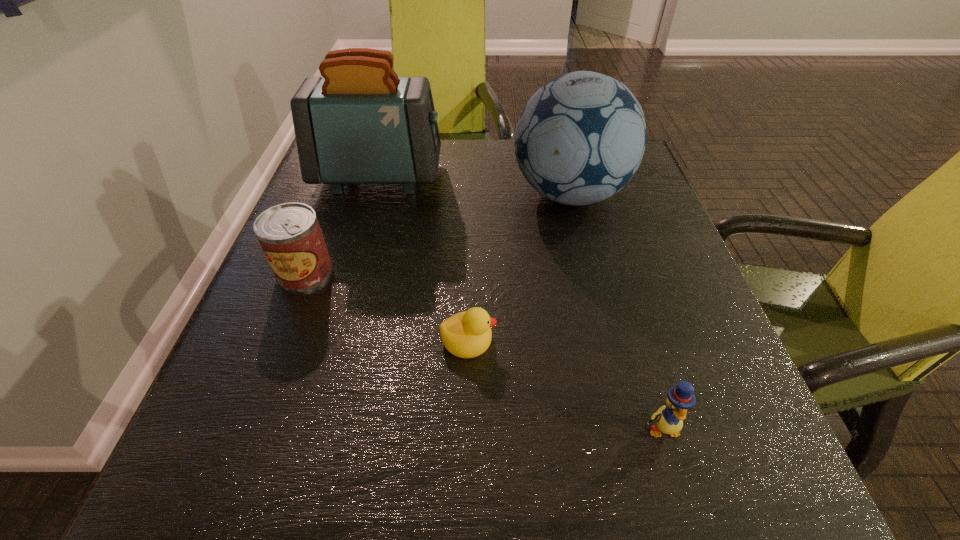
This screenshot has height=540, width=960. Identify the location of vacant space in between the shortest object and the third farthest object. (387, 306).

You are a GUI agent. You are given a task and a screenshot of the screen. Output one action in this format:
    pyautogui.click(x=<x>, y=<y>)
    Task: Click on the unoccupied area between the taller duckling and the farther duckling
    Image resolution: width=960 pixels, height=540 pixels.
    Given the screenshot: What is the action you would take?
    pyautogui.click(x=564, y=383)

Where is `blank region between the soccer ball and the third object from left to right`? The width and height of the screenshot is (960, 540). blank region between the soccer ball and the third object from left to right is located at coordinates (518, 267).

You are a GUI agent. You are given a task and a screenshot of the screen. Output one action in this format:
    pyautogui.click(x=<x>, y=<y>)
    Task: Click on the vacant space that is in between the soccer ball and the toaster
    The height and width of the screenshot is (540, 960).
    Given the screenshot: What is the action you would take?
    pyautogui.click(x=474, y=185)

The height and width of the screenshot is (540, 960). In order to click on vacant space that's between the nearer duckling and the soccer ball in this screenshot , I will do `click(615, 311)`.

At what (x,y) coordinates should I click in order to perform the action: click on free point between the shorter duckling and the can. Please return your answer as a coordinate pair (x, y). The height and width of the screenshot is (540, 960). Looking at the image, I should click on (387, 306).

You are a GUI agent. You are given a task and a screenshot of the screen. Output one action in this format:
    pyautogui.click(x=<x>, y=<y>)
    Task: Click on the free space between the second nearest object and the can
    Image resolution: width=960 pixels, height=540 pixels.
    Given the screenshot: What is the action you would take?
    pyautogui.click(x=387, y=306)

Locate which object is the third closest to the soccer ball. Please provide its 2D coordinates. Your answer should be formatted as a tuple, i.e. [(x, y)], where the tuple contains the x and y coordinates of a point satisfying the conditions above.

[(290, 235)]

Locate which object ranks fourth in proximity to the toaster. Please provide its 2D coordinates. Your answer should be formatted as a tuple, i.e. [(x, y)], where the tuple contains the x and y coordinates of a point satisfying the conditions above.

[(668, 419)]